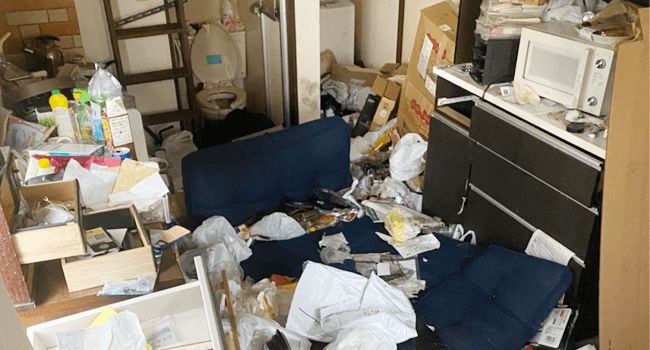
You are a GUI agent. You are given a task and a screenshot of the screen. Output one action in this format:
    pyautogui.click(x=<x>, y=<y>)
    Task: Click on the open drawers
    
    Given the screenshot: What is the action you would take?
    pyautogui.click(x=62, y=223)